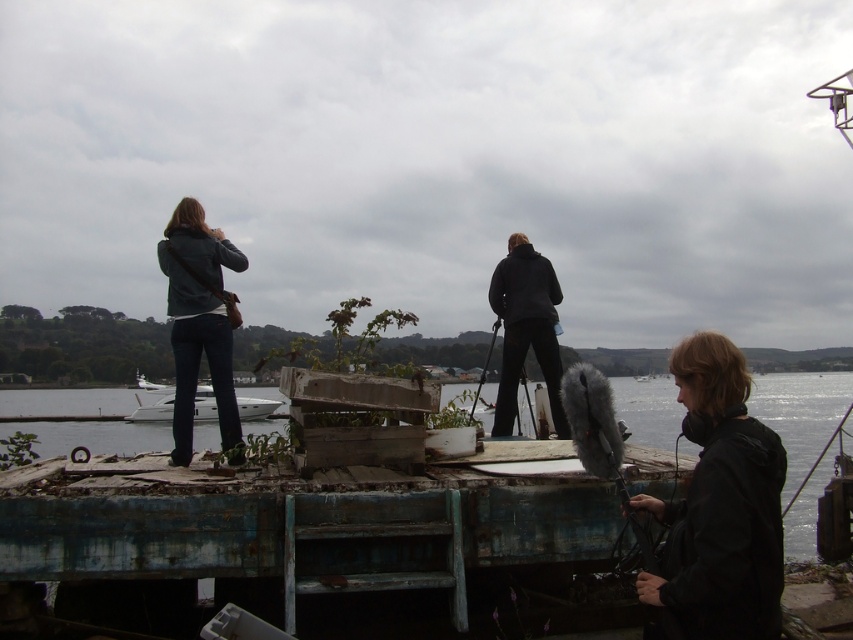
You are standing on the wooden structure and need to place a heavy object on the white glossy boat at center. Based on the coordinates provided, is the boat positioned to the left or right side of the structure?

The white glossy boat at center is located at point 0.642 on the x and 0.181 on the y. Since the x coordinate is greater than 0.5, it is positioned to the right side of the structure.

You are a photographer positioned behind the black matte jacket at center and the metallic silver fishing pole at center. Which object is closer to your camera?

The black matte jacket at center is closer to the camera because it is further to the viewer than the metallic silver fishing pole at center.